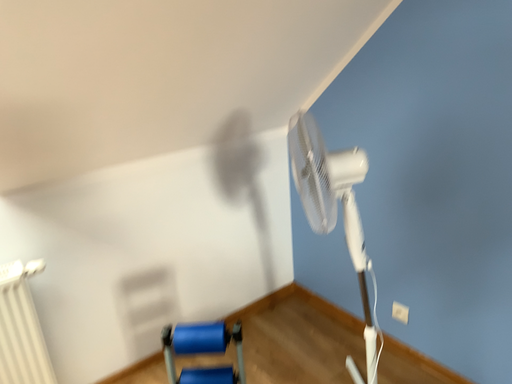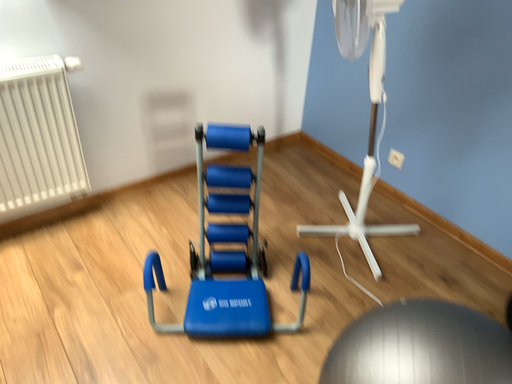
Question: How did the camera likely rotate when shooting the video?

Choices:
 (A) rotated upward
 (B) rotated downward

Answer: (B)